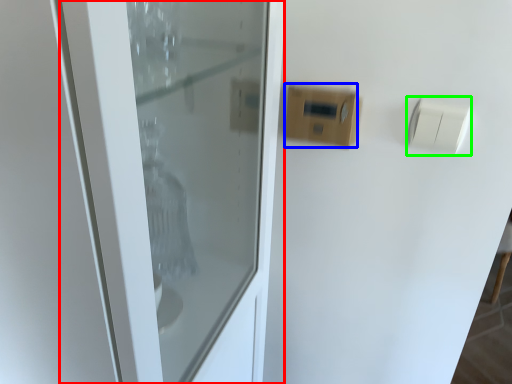
Question: Which object is positioned closest to door (highlighted by a red box)? Select from light switch (highlighted by a blue box) and light switch (highlighted by a green box).

Choices:
 (A) light switch
 (B) light switch

Answer: (A)